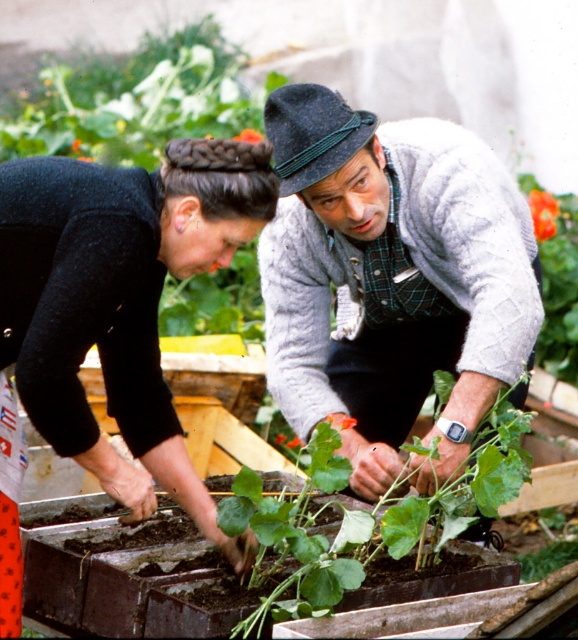
Does gray wool sweater at center come in front of orange flower at upper right?

That is True.

Who is more forward, (420, 125) or (557, 224)?

Point (420, 125)

The image size is (578, 640). Identify the location of gray wool sweater at center. (391, 276).

Between point (561, 225) and point (342, 420), which one is positioned in front?

Point (342, 420)

Does orange flower at upper right have a larger size compared to orange matte flower at center?

Yes, orange flower at upper right is bigger than orange matte flower at center.

Which is in front, point (562, 292) or point (335, 426)?

Point (335, 426) is more forward.

This screenshot has height=640, width=578. Identify the location of orange flower at upper right. (555, 276).

Who is more forward, (507, 483) or (550, 232)?

Point (507, 483)

Is green leafy plant at center wider than orange flower at upper right?

Correct, the width of green leafy plant at center exceeds that of orange flower at upper right.

Does point (316, 586) lie behind point (568, 198)?

No, (316, 586) is in front of (568, 198).

Identify the location of green leafy plant at center. This screenshot has height=640, width=578. (364, 518).